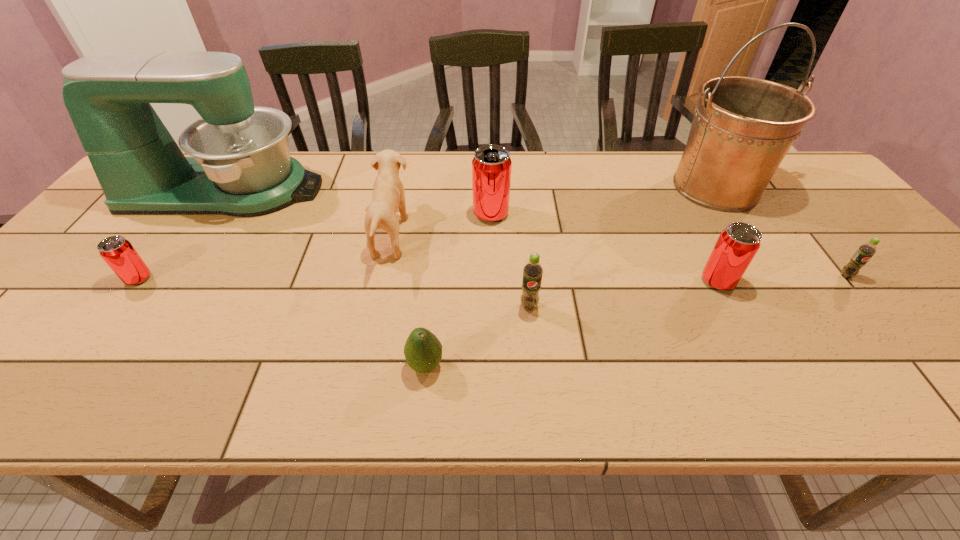
Identify the location of the tallest object. (743, 127).

Image resolution: width=960 pixels, height=540 pixels. I want to click on mixer, so click(x=240, y=166).

Image resolution: width=960 pixels, height=540 pixels. I want to click on the biggest red soda can, so click(491, 166).

Where is `the second soda from left to right`? The height and width of the screenshot is (540, 960). the second soda from left to right is located at coordinates (491, 166).

Where is `the seventh object from right to left`? The image size is (960, 540). the seventh object from right to left is located at coordinates (388, 195).

Locate an element on the screen. The height and width of the screenshot is (540, 960). puppy is located at coordinates (388, 195).

Identify the location of the nearer green soda. The width and height of the screenshot is (960, 540). (532, 271).

Locate an element on the screen. The image size is (960, 540). the fourth object from right to left is located at coordinates (532, 271).

Where is `the second smallest red soda can`? the second smallest red soda can is located at coordinates (737, 245).

Image resolution: width=960 pixels, height=540 pixels. I want to click on the second soda from right to left, so click(x=737, y=245).